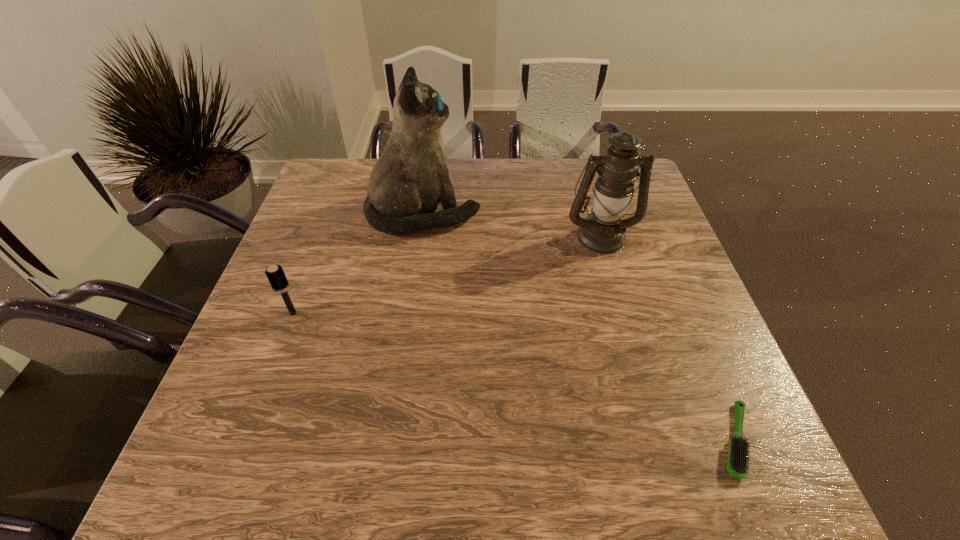
This screenshot has height=540, width=960. What are the coordinates of `free region located 0.200m on the back of the nearer hairbrush` in the screenshot? It's located at (686, 322).

You are a GUI agent. You are given a task and a screenshot of the screen. Output one action in this format:
    pyautogui.click(x=<x>, y=<y>)
    Task: Click on the object positioned at the far edge
    The width and height of the screenshot is (960, 540).
    Given the screenshot: What is the action you would take?
    pyautogui.click(x=407, y=182)

Identify the location of object located at the near edge. The width and height of the screenshot is (960, 540). (737, 463).

This screenshot has height=540, width=960. I want to click on object that is at the left edge, so click(x=275, y=274).

What are the coordinates of `oil lamp located at the right edge` in the screenshot? It's located at (603, 231).

I want to click on hairbrush that is positioned at the right edge, so click(737, 463).

You are a GUI agent. You are given a task and a screenshot of the screen. Output one action in this format:
    pyautogui.click(x=<x>, y=<y>)
    Task: Click on the object that is at the near right corner
    The width and height of the screenshot is (960, 540).
    Given the screenshot: What is the action you would take?
    pyautogui.click(x=737, y=463)

Find the location of `vacant space at the far edge`. vacant space at the far edge is located at coordinates (571, 180).

Where is `vacant area at the near edge of the desktop`? vacant area at the near edge of the desktop is located at coordinates (602, 445).

Where is `vacant region at the left edge of the desktop`? The image size is (960, 540). vacant region at the left edge of the desktop is located at coordinates (338, 210).